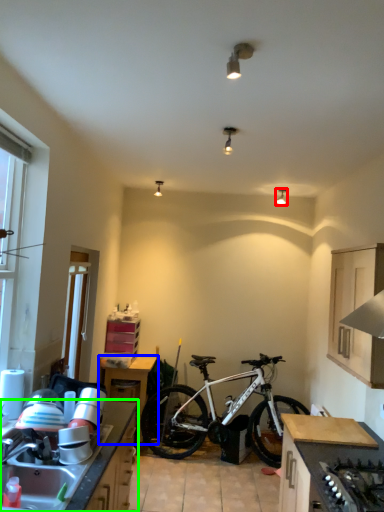
Question: Which object is positioned closest to lamp (highlighted by a red box)? Select from table (highlighted by a blue box) and countertop (highlighted by a green box).

Choices:
 (A) table
 (B) countertop

Answer: (A)